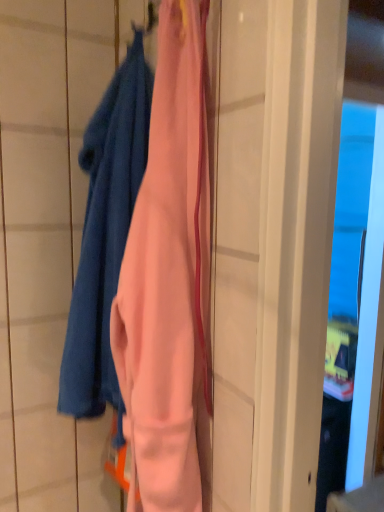
Locate an element on the screen. This screenshot has width=384, height=512. peach fleece towel at center is located at coordinates [x=105, y=234].

Consider the image. Measure the distance between point (98, 263) and camera.

89.60 centimeters.

This screenshot has height=512, width=384. What do you see at coordinates (105, 234) in the screenshot?
I see `peach fleece towel at center` at bounding box center [105, 234].

Image resolution: width=384 pixels, height=512 pixels. In order to click on peach fleece towel at center in this screenshot , I will do `click(105, 234)`.